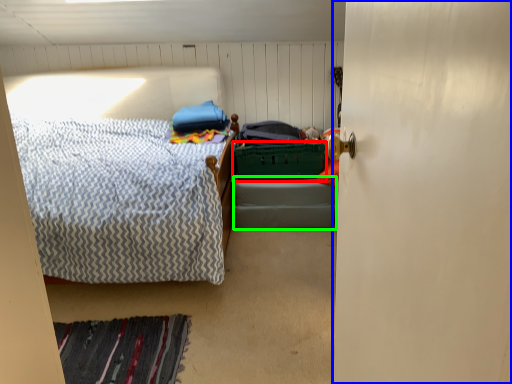
Question: Estimate the real-world distances between objects in this image. Which object is closer to laundry basket (highlighted by a red box), door (highlighted by a blue box) or bed frame (highlighted by a green box)?

Choices:
 (A) door
 (B) bed frame

Answer: (B)